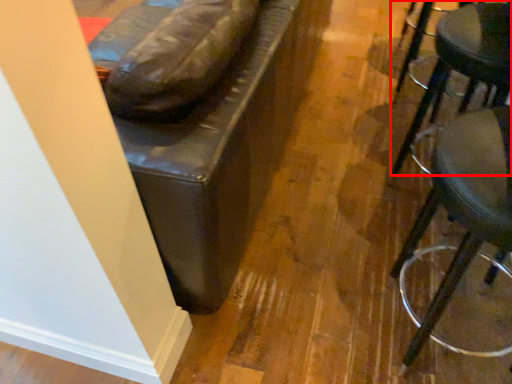
Question: In this image, where is stool (annotated by the red box) located relative to stool?

Choices:
 (A) left
 (B) right

Answer: (B)